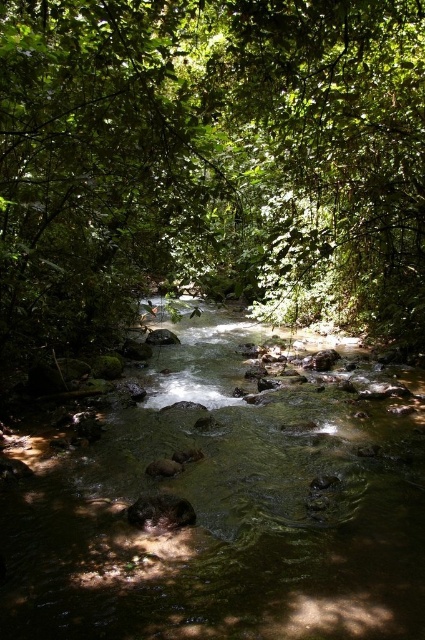
You are a hiker standing at the edge of the stream. You want to take a photo of the green leafy tree at center and the clear water at center. Which object should you focus on first if you want both to be in sharp focus?

You should focus on the green leafy tree at center first because it is closer to you than the clear water at center, which is further away. This way, both will be in focus as the tree is the foreground and the water is the background.

Based on the photo, you are a hiker who wants to cross the stream safely. The green leafy tree at center is on your current side, and the clear water at center is where you want to cross. Given that the stream is 13.10 feet wide here, can you safely cross it in one leap?

The distance between the green leafy tree at center and the clear water at center is 13.10 feet. Since the stream is 13.10 feet wide at this point, a hiker would need to assess their jumping ability. Most people can jump about 4 to 6 feet, so leaping 13.10 feet would be extremely challenging and unsafe. It is advisable to look for a narrower spot or use a sturdy branch for support.

You are a hiker trying to cross the stream using the rocks. The green leafy tree at center is casting a shadow over the clear water at center. Which object would you need to avoid stepping on to stay dry?

You should avoid stepping on the clear water at center since it is the water surface. The green leafy tree at center is taller and likely not an obstacle to step on, but the clear water at center is where the stream flows, so stepping there would get you wet.